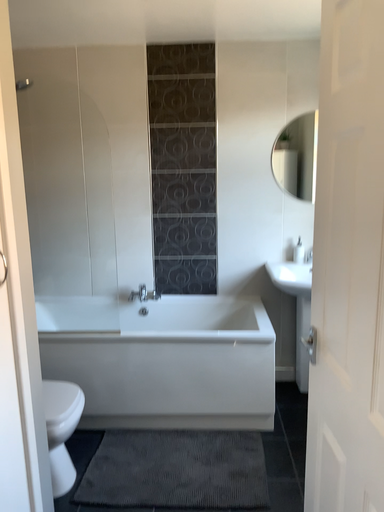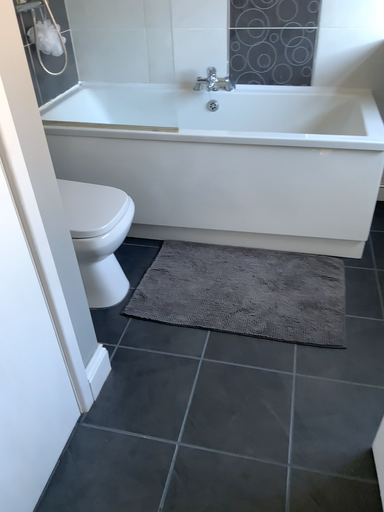
Question: Which way did the camera rotate in the video?

Choices:
 (A) rotated downward
 (B) rotated upward

Answer: (A)